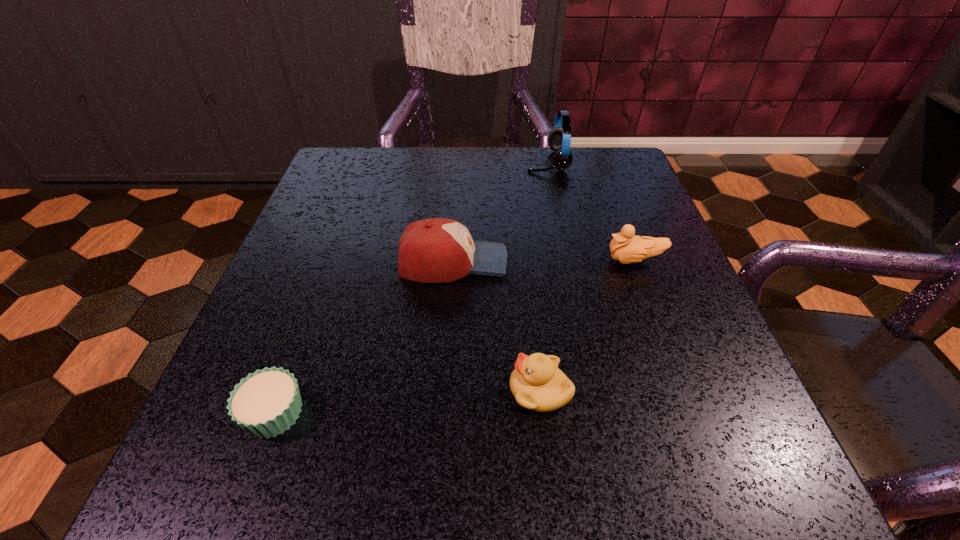
This screenshot has width=960, height=540. I want to click on headset, so click(x=559, y=140).

Where is `the tallest object`? This screenshot has height=540, width=960. the tallest object is located at coordinates (559, 140).

In order to click on baseball cap in this screenshot , I will do `click(435, 250)`.

Identify the location of the right duckling. The image size is (960, 540). (626, 248).

This screenshot has width=960, height=540. Find the location of `the farther duckling`. the farther duckling is located at coordinates (626, 248).

I want to click on the nearer duckling, so click(x=537, y=383).

This screenshot has height=540, width=960. What are the coordinates of `the shortest object` in the screenshot? It's located at (266, 403).

The height and width of the screenshot is (540, 960). I want to click on the leftmost object, so click(266, 403).

Locate an element on the screen. vacant space located with the microphone attached to the side of the headset is located at coordinates coord(468,161).

This screenshot has height=540, width=960. What are the coordinates of `free space located 0.070m with the microphone attached to the side of the headset` in the screenshot? It's located at pyautogui.click(x=496, y=161).